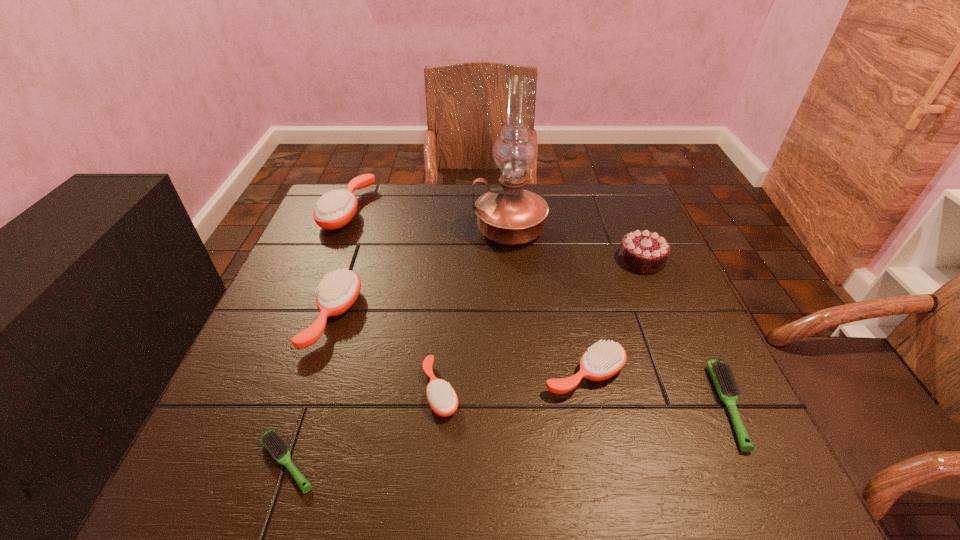
Find the location of a particular element. The width and height of the screenshot is (960, 540). free space at the left edge is located at coordinates (236, 395).

Find the location of a particular element. Image resolution: width=960 pixels, height=540 pixels. vacant area at the right edge of the desktop is located at coordinates (662, 287).

You are a GUI agent. You are given a task and a screenshot of the screen. Output one action in this format:
    pyautogui.click(x=<x>, y=<y>)
    Task: Click on the free space at the near left corner of the desktop
    
    Given the screenshot: What is the action you would take?
    pyautogui.click(x=188, y=471)

This screenshot has height=540, width=960. What are the coordinates of `vacant space at the far right corner` in the screenshot? It's located at (630, 210).

This screenshot has height=540, width=960. What are the coordinates of `free spot at the near right corner of the desktop` in the screenshot? It's located at (721, 487).

Locate an element on the screen. empty space that is in between the tallest object and the biggest orange hairbrush is located at coordinates (428, 220).

Where is `free spot between the bigger light hairbrush and the farthest orange hairbrush`? This screenshot has width=960, height=540. free spot between the bigger light hairbrush and the farthest orange hairbrush is located at coordinates (539, 308).

Identify the location of free space between the second smallest orange hairbrush and the oil lamp. (547, 302).

Locate an element on the screen. free point between the shortest object and the fifth shortest hairbrush is located at coordinates (310, 389).

This screenshot has width=960, height=540. Identify the location of free point between the fourth tallest object and the third tallest hairbrush. (459, 345).